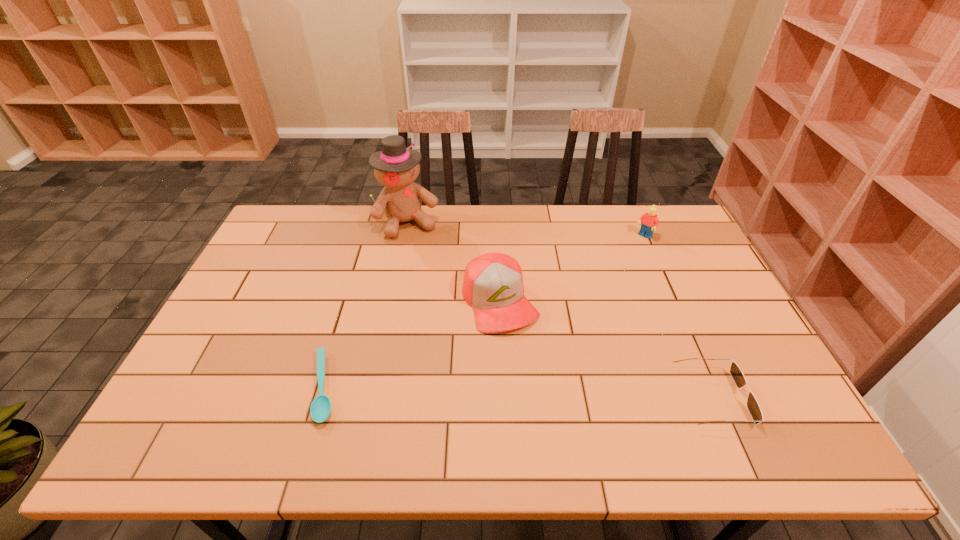
I want to click on spoon, so click(320, 409).

Identify the location of the second shortest object. (736, 373).

You are a GUI agent. You are given a task and a screenshot of the screen. Output one action in this format:
    pyautogui.click(x=<x>, y=<y>)
    Task: Click on the baseball cap
    Image resolution: width=960 pixels, height=540 pixels.
    Given the screenshot: What is the action you would take?
    pyautogui.click(x=493, y=282)

Where is `the third nearest object`? the third nearest object is located at coordinates (493, 282).

Where is `Lego`? This screenshot has width=960, height=540. Lego is located at coordinates (649, 220).

What are the coordinates of `rag_doll` in the screenshot? It's located at (396, 167).

This screenshot has width=960, height=540. I want to click on vacant area situated 0.260m on the left of the shortest object, so click(x=202, y=387).

Where is `blank space located 0.250m on the front-facing side of the third nearest object`? The width and height of the screenshot is (960, 540). blank space located 0.250m on the front-facing side of the third nearest object is located at coordinates (555, 413).

You are a GUI agent. You are given a task and a screenshot of the screen. Output one action in this format:
    pyautogui.click(x=<x>, y=<y>)
    Task: Click on the free space located on the front-facing side of the third nearest object
    This screenshot has width=960, height=540.
    Given the screenshot: What is the action you would take?
    pyautogui.click(x=539, y=381)

The height and width of the screenshot is (540, 960). Identify the location of vacant area situated on the front-facing side of the third nearest object. (532, 369).